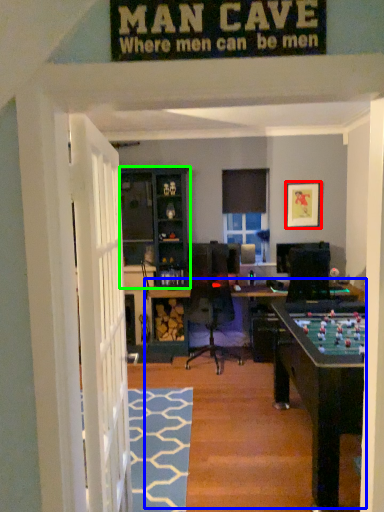
Question: Estimate the real-world distances between objects in this image. Which object is farther from picture frame (highlighted by a red box), table (highlighted by a blue box) or cabinetry (highlighted by a green box)?

Choices:
 (A) table
 (B) cabinetry

Answer: (A)